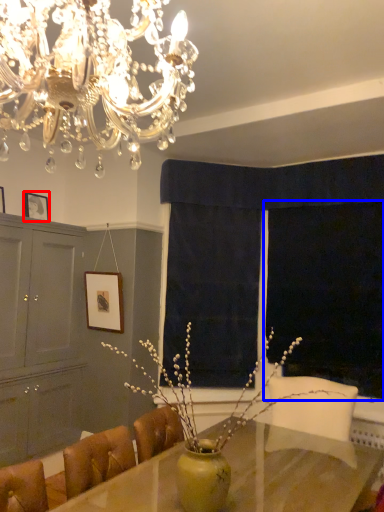
Question: Which object is further to the camera taking this photo, picture frame (highlighted by a red box) or window screen (highlighted by a blue box)?

Choices:
 (A) picture frame
 (B) window screen

Answer: (A)